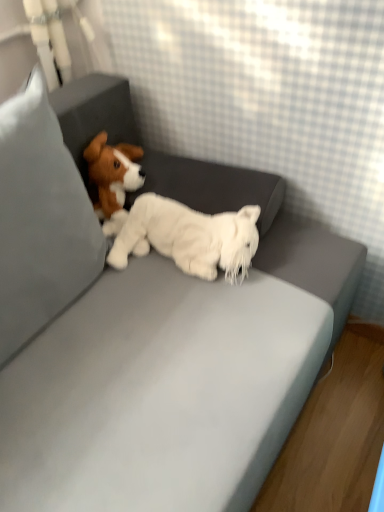
Question: Considering the positions of white fabric pillow at left and white plush toy at center in the image, is white fabric pillow at left taller or shorter than white plush toy at center?

Choices:
 (A) tall
 (B) short

Answer: (A)

Question: From the image's perspective, relative to white plush toy at center, is white fabric pillow at left above or below?

Choices:
 (A) below
 (B) above

Answer: (B)

Question: Based on their positions, is white fabric pillow at left located to the left or right of white plush toy at center?

Choices:
 (A) left
 (B) right

Answer: (A)

Question: In the image, is white plush toy at center on the left side or the right side of white fabric pillow at left?

Choices:
 (A) left
 (B) right

Answer: (B)

Question: From the image's perspective, relative to white fabric pillow at left, is white plush toy at center above or below?

Choices:
 (A) above
 (B) below

Answer: (B)

Question: Is point (185, 246) closer or farther from the camera than point (59, 138)?

Choices:
 (A) farther
 (B) closer

Answer: (A)

Question: Would you say white plush toy at center is inside or outside white fabric pillow at left?

Choices:
 (A) outside
 (B) inside

Answer: (A)